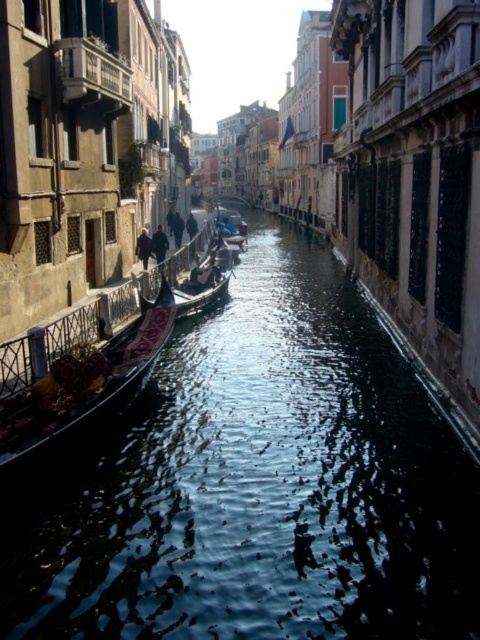
Is clear water at center to the right of black polished gondola at left from the viewer's perspective?

Correct, you'll find clear water at center to the right of black polished gondola at left.

Is clear water at center bigger than black polished gondola at left?

Yes, clear water at center is bigger than black polished gondola at left.

In order to click on clear water at center in this screenshot , I will do `click(257, 484)`.